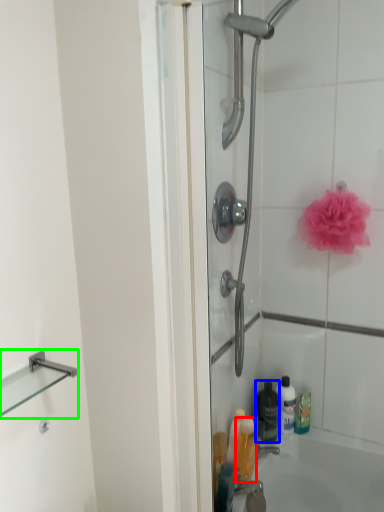
Question: Based on their relative distances, which object is farther from toiletry (highlighted by a red box)? Choose from bottle (highlighted by a blue box) and balustrade (highlighted by a green box).

Choices:
 (A) bottle
 (B) balustrade

Answer: (B)